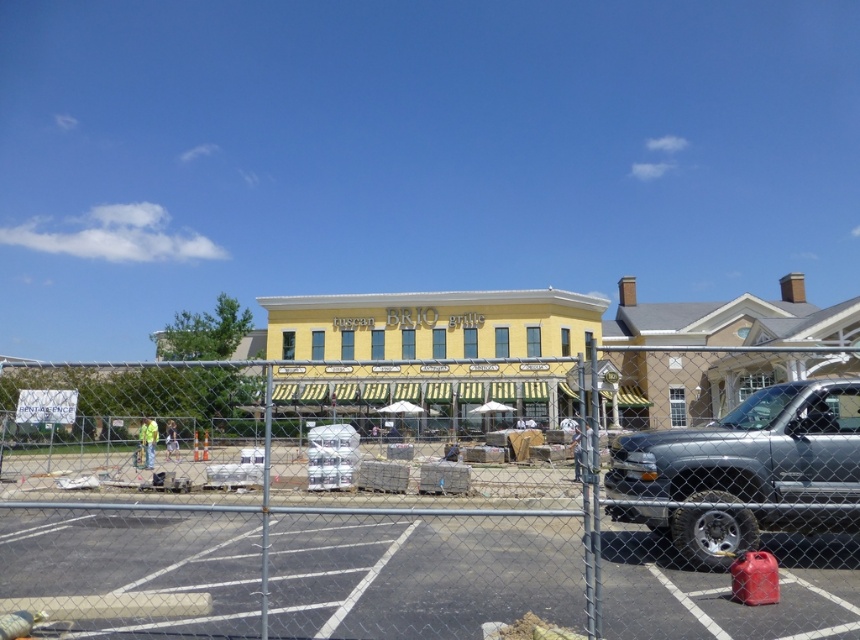
Does point (478, 604) lie in front of point (828, 456)?

Yes, it is in front of point (828, 456).

Can you confirm if chain link fence at center is taller than silver metallic pickup truck at right?

Yes, chain link fence at center is taller than silver metallic pickup truck at right.

Describe the element at coordinates (422, 509) in the screenshot. I see `chain link fence at center` at that location.

Image resolution: width=860 pixels, height=640 pixels. In order to click on chain link fence at center in this screenshot , I will do `click(422, 509)`.